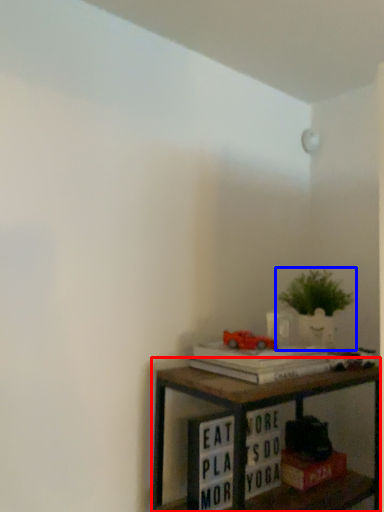
Question: Which point is closer to the camera, shelf (highlighted by a red box) or houseplant (highlighted by a blue box)?

Choices:
 (A) shelf
 (B) houseplant

Answer: (A)